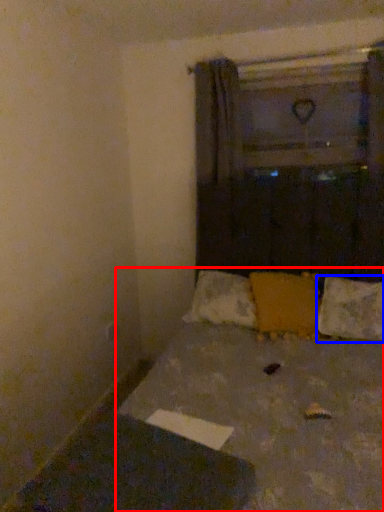
Question: Which object is closer to the camera taking this photo, bed (highlighted by a red box) or pillow (highlighted by a blue box)?

Choices:
 (A) bed
 (B) pillow

Answer: (A)